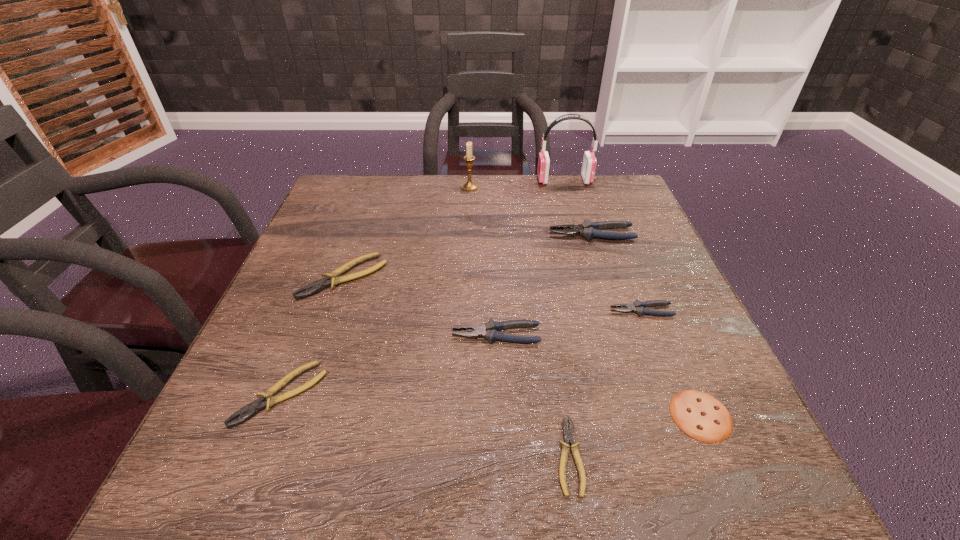
You are a GUI agent. You are given a task and a screenshot of the screen. Output one action in this format:
    pyautogui.click(x=<x>, y=<y>)
    Task: Click on the tallest object
    The height and width of the screenshot is (540, 960).
    Given the screenshot: What is the action you would take?
    pyautogui.click(x=589, y=160)

This screenshot has height=540, width=960. In order to click on pink earphone in this screenshot , I will do `click(589, 160)`.

Locate an element on the screen. candle holder is located at coordinates (469, 185).

Where is `the biggest gray pliers`? The width and height of the screenshot is (960, 540). the biggest gray pliers is located at coordinates coord(587,229).

Find the location of `the farthest pliers`. the farthest pliers is located at coordinates (587, 229).

Where is `the second biggest gray pliers`? the second biggest gray pliers is located at coordinates (489, 331).

Identify the location of the leftmost gray pliers. (489, 331).

Locate an element on the screen. This screenshot has height=540, width=960. the farthest yellow pliers is located at coordinates (332, 279).

At what (x,y) coordinates should I click in order to perform the action: click on the second farthest pliers. Please return your answer as a coordinate pair (x, y). The height and width of the screenshot is (540, 960). Looking at the image, I should click on (332, 279).

Locate an element on the screen. Image resolution: width=960 pixels, height=540 pixels. the second farthest gray pliers is located at coordinates (638, 307).